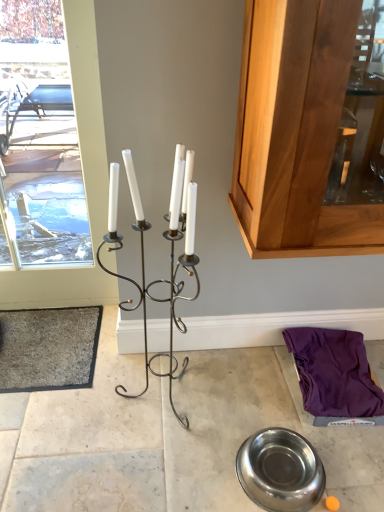
The width and height of the screenshot is (384, 512). Describe the element at coordinates (170, 257) in the screenshot. I see `black wrought iron candle holder at center` at that location.

Where is `metallic silver bowl at lower center`? The width and height of the screenshot is (384, 512). metallic silver bowl at lower center is located at coordinates (170, 438).

From the picture: In order to face polished stainless steel bowl at lower center, should I rotate leftwards or rightwards?

To align with it, rotate right about 11.666°.

At what (x,y) coordinates should I click in order to perform the action: click on polished stainless steel bowl at lower center. Please return your answer as a coordinate pair (x, y). The image size is (384, 512). Looking at the image, I should click on (280, 470).

Find the location of a particular element. The image size is (384, 512). white glass window at left is located at coordinates (40, 136).

Identify the location of gray carpet at lower left. (48, 349).

At what (x,y) coordinates should I click in order to perform the action: click on black wrought iron candle holder at center. Please return your answer as a coordinate pair (x, y). Looking at the image, I should click on (170, 257).

Which is behind, polished stainless steel bowl at lower center or white glass window at left?

white glass window at left is more distant.

From a real-world perspective, which object rests below the other?

polished stainless steel bowl at lower center, from a real-world perspective.

From the image's perspective, would you say polished stainless steel bowl at lower center is positioned over white glass window at left?

No.

From a real-world perspective, who is located lower, polished stainless steel bowl at lower center or metallic silver bowl at lower center?

metallic silver bowl at lower center.

Is point (264, 479) positioned before point (274, 394)?

Yes, point (264, 479) is in front of point (274, 394).

Is polished stainless steel bowl at lower center positioned with its back to metallic silver bowl at lower center?

Yes, polished stainless steel bowl at lower center is facing away from metallic silver bowl at lower center.

Is metallic silver bowl at lower center inside polished stainless steel bowl at lower center?

Actually, metallic silver bowl at lower center is outside polished stainless steel bowl at lower center.

From a real-world perspective, which is physically below, gray carpet at lower left or polished stainless steel bowl at lower center?

gray carpet at lower left is physically lower.

Considering the relative sizes of gray carpet at lower left and polished stainless steel bowl at lower center in the image provided, is gray carpet at lower left taller than polished stainless steel bowl at lower center?

In fact, gray carpet at lower left may be shorter than polished stainless steel bowl at lower center.

How far apart are gray carpet at lower left and polished stainless steel bowl at lower center?

gray carpet at lower left and polished stainless steel bowl at lower center are 33.86 inches apart.

Would you say gray carpet at lower left contains polished stainless steel bowl at lower center?

No, polished stainless steel bowl at lower center is not surrounded by gray carpet at lower left.

Which of these two, metallic silver bowl at lower center or gray carpet at lower left, is smaller?

Smaller between the two is gray carpet at lower left.

How different are the orientations of metallic silver bowl at lower center and gray carpet at lower left in degrees?

The angular difference between metallic silver bowl at lower center and gray carpet at lower left is 89.5 degrees.

Is point (368, 355) closer or farther from the camera than point (27, 326)?

Point (368, 355) appears to be closer to the viewer than point (27, 326).

Does metallic silver bowl at lower center turn towards gray carpet at lower left?

No, metallic silver bowl at lower center is not oriented towards gray carpet at lower left.

Looking at this image, from a real-world perspective, is metallic silver bowl at lower center physically above polished stainless steel bowl at lower center?

Incorrect, from a real-world perspective, metallic silver bowl at lower center is lower than polished stainless steel bowl at lower center.

Is metallic silver bowl at lower center directly adjacent to polished stainless steel bowl at lower center?

There is a gap between metallic silver bowl at lower center and polished stainless steel bowl at lower center.

From the image's perspective, is polished stainless steel bowl at lower center located above gray carpet at lower left?

No.

Is gray carpet at lower left at the back of polished stainless steel bowl at lower center?

No, polished stainless steel bowl at lower center is not facing the opposite direction of gray carpet at lower left.

Looking at this image, is polished stainless steel bowl at lower center to the left or to the right of gray carpet at lower left in the image?

Based on their positions, polished stainless steel bowl at lower center is located to the right of gray carpet at lower left.

Is gray carpet at lower left surrounded by polished stainless steel bowl at lower center?

No, gray carpet at lower left is not inside polished stainless steel bowl at lower center.

From the picture: From the image's perspective, is white glass window at left beneath polished stainless steel bowl at lower center?

No, from the image's perspective, white glass window at left is not beneath polished stainless steel bowl at lower center.

Considering the sizes of objects white glass window at left and polished stainless steel bowl at lower center in the image provided, who is thinner, white glass window at left or polished stainless steel bowl at lower center?

white glass window at left.

The height and width of the screenshot is (512, 384). I want to click on tableware located in front of the white glass window at left, so click(x=280, y=470).

The width and height of the screenshot is (384, 512). In the image, there is a white glass window at left. In order to click on tableware below it (from a real-world perspective) in this screenshot , I will do `click(280, 470)`.

Where is `tableware behind the metallic silver bowl at lower center`? tableware behind the metallic silver bowl at lower center is located at coordinates (280, 470).

When comparing their distances from white glass window at left, does metallic silver bowl at lower center or black wrought iron candle holder at center seem further?

black wrought iron candle holder at center lies further to white glass window at left than the other object.

Based on their spatial positions, is polished stainless steel bowl at lower center or metallic silver bowl at lower center closer to gray carpet at lower left?

metallic silver bowl at lower center.

When comparing their distances from black wrought iron candle holder at center, does gray carpet at lower left or white glass window at left seem further?

Among the two, white glass window at left is located further to black wrought iron candle holder at center.

Looking at the image, which one is located closer to black wrought iron candle holder at center, metallic silver bowl at lower center or gray carpet at lower left?

metallic silver bowl at lower center is positioned closer to the anchor black wrought iron candle holder at center.

Based on their spatial positions, is metallic silver bowl at lower center or gray carpet at lower left closer to polished stainless steel bowl at lower center?

metallic silver bowl at lower center.

Based on their spatial positions, is polished stainless steel bowl at lower center or gray carpet at lower left further from metallic silver bowl at lower center?

Based on the image, gray carpet at lower left appears to be further to metallic silver bowl at lower center.

Looking at this image, which object lies nearer to the anchor point polished stainless steel bowl at lower center, black wrought iron candle holder at center or white glass window at left?

black wrought iron candle holder at center is positioned closer to the anchor polished stainless steel bowl at lower center.

In the scene shown: Considering their positions, is polished stainless steel bowl at lower center positioned closer to black wrought iron candle holder at center than metallic silver bowl at lower center?

Among the two, metallic silver bowl at lower center is located nearer to black wrought iron candle holder at center.

Image resolution: width=384 pixels, height=512 pixels. What are the coordinates of `concrete between black wrought iron candle holder at center and polished stainless steel bowl at lower center in the up-down direction` in the screenshot? It's located at (170, 438).

Locate an element on the screen. This screenshot has height=512, width=384. candle holder between gray carpet at lower left and polished stainless steel bowl at lower center in the horizontal direction is located at coordinates tap(170, 257).

You are a GUI agent. You are given a task and a screenshot of the screen. Output one action in this format:
    pyautogui.click(x=<x>, y=<y>)
    Task: Click on the window frame between gray carpet at lower left and polished stainless steel bowl at lower center
    The image size is (384, 512).
    Given the screenshot: What is the action you would take?
    pyautogui.click(x=40, y=136)

In order to click on candle holder between white glass window at left and gray carpet at lower left vertically in this screenshot , I will do `click(170, 257)`.